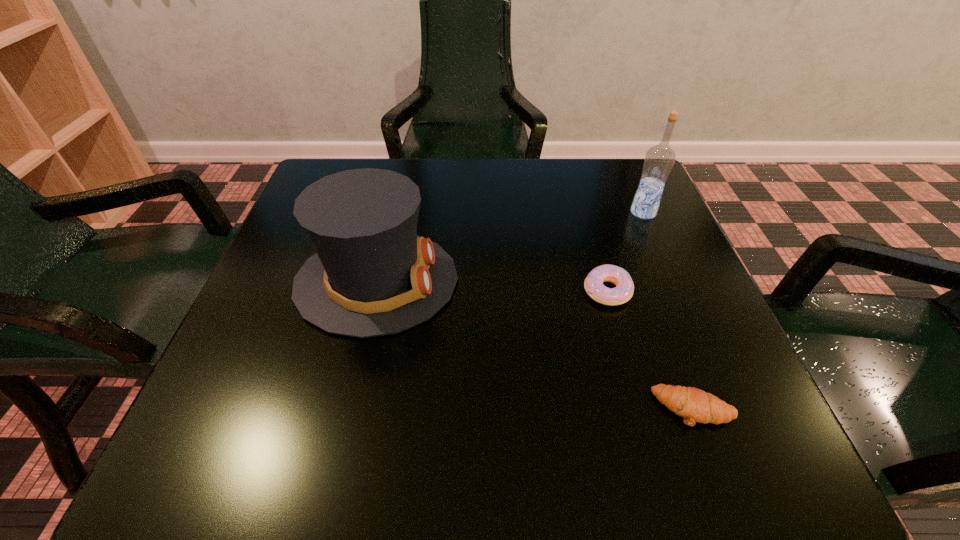
Where is `object that is at the far edge`? object that is at the far edge is located at coordinates (659, 160).

I want to click on object located at the near edge, so click(694, 405).

You are a GUI agent. You are given a task and a screenshot of the screen. Output one action in this format:
    pyautogui.click(x=<x>, y=<y>)
    Task: Click on the object that is at the left edge
    The width and height of the screenshot is (960, 540).
    Given the screenshot: What is the action you would take?
    pyautogui.click(x=372, y=275)

Find the location of a particular element. This screenshot has height=540, width=960. vodka located at the right edge is located at coordinates pos(659,160).

Find the location of a particular element. doughnut situated at the right edge is located at coordinates (593, 284).

At what (x,y) coordinates should I click in order to perform the action: click on crescent roll at the right edge. Please return your answer as a coordinate pair (x, y). Looking at the image, I should click on coord(694,405).

The height and width of the screenshot is (540, 960). Identify the location of object that is positioned at the far right corner. (659, 160).

You are a GUI agent. You are given a task and a screenshot of the screen. Output one action in this format:
    pyautogui.click(x=<x>, y=<y>)
    Task: Click on the object situated at the near right corner
    This screenshot has width=960, height=540.
    Given the screenshot: What is the action you would take?
    click(694, 405)

At what (x,y) coordinates should I click in order to perform the action: click on free space at the far edge. Please return your answer as a coordinate pair (x, y). Looking at the image, I should click on pos(468,160).

You are a GUI agent. You are given a task and a screenshot of the screen. Output one action in this format:
    pyautogui.click(x=<x>, y=<y>)
    Task: Click on the blank space at the near edge of the desktop
    
    Given the screenshot: What is the action you would take?
    pyautogui.click(x=604, y=453)